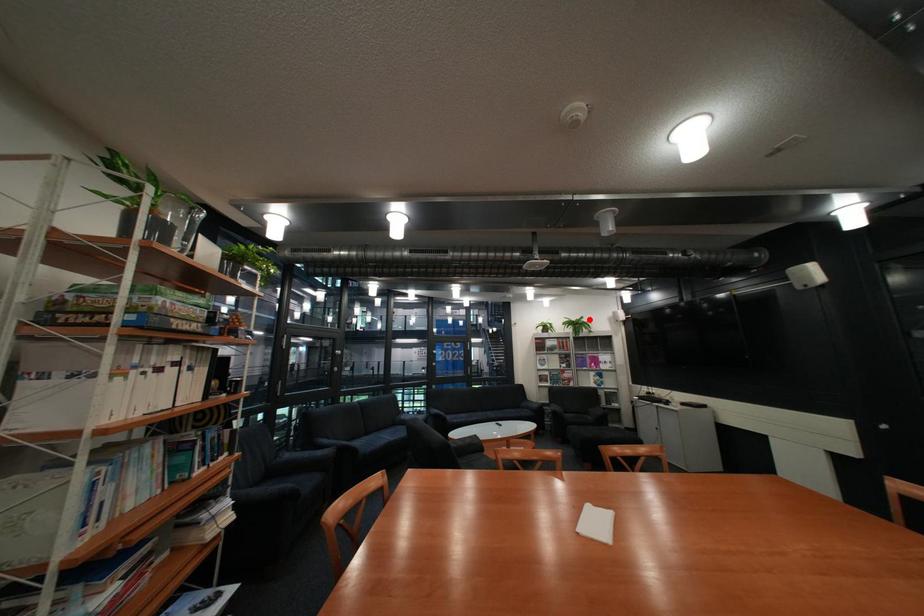
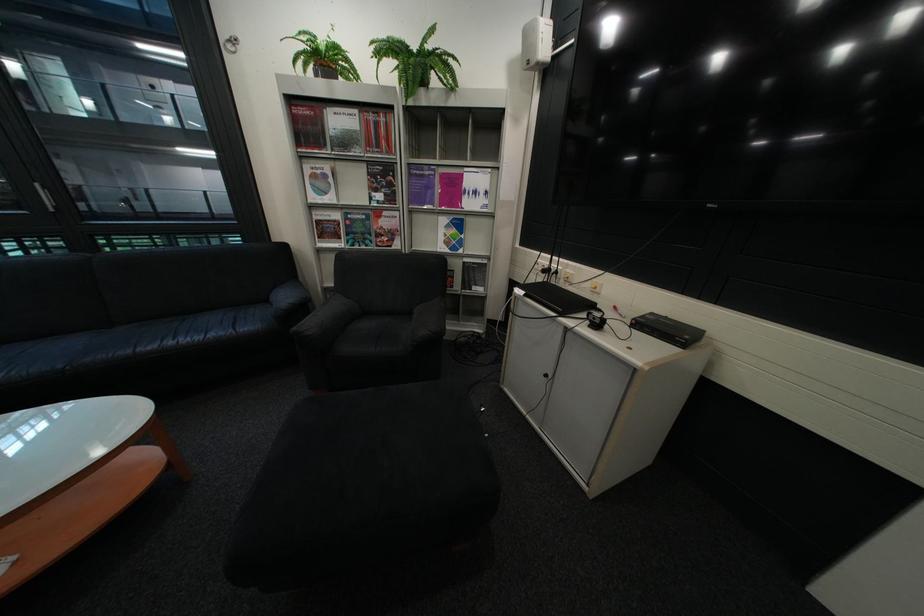
In the second image, find the point that corresponds to the highlighted location in the first image.

(430, 46)